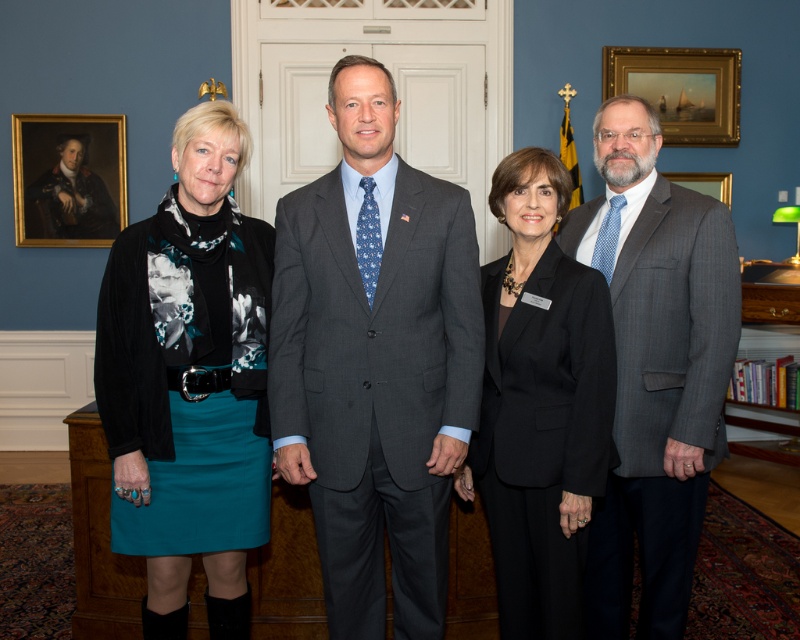
You are an interior designer assessing the layout of this formal indoor space. You notice the teal fabric skirt at left and the black matte suit at center. Which object is positioned higher in the scene?

The teal fabric skirt at left is much taller than the black matte suit at center, so it is positioned higher in the scene.

You are a photographer positioned in front of the group and want to focus your camera on the black matte suit at center without the teal fabric skirt at left blocking the view. Is this possible based on their positions?

The teal fabric skirt at left is further to the viewer than black matte suit at center, so the teal fabric skirt at left would block the view of the black matte suit at center. Therefore, it is not possible to focus on the black matte suit at center without the teal fabric skirt at left blocking the view.